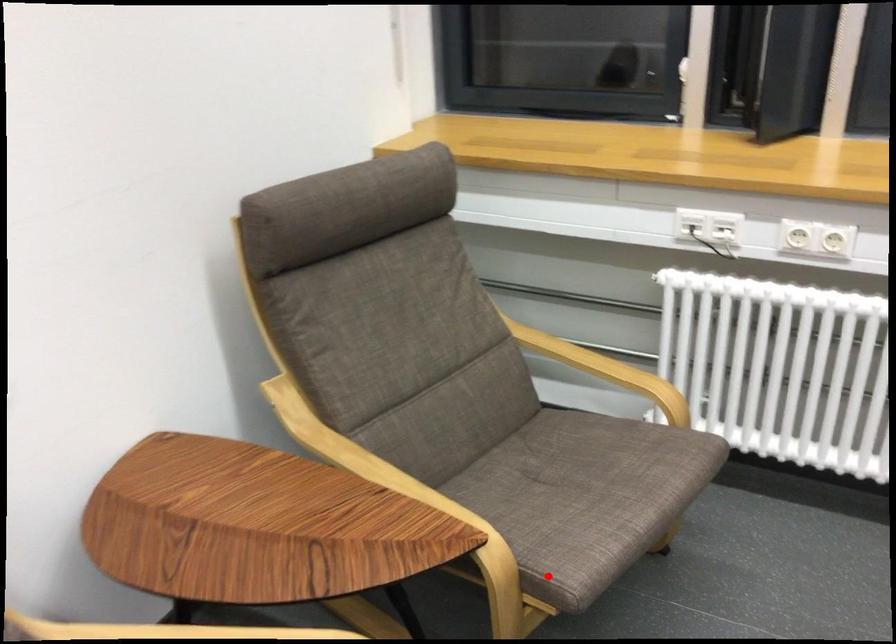
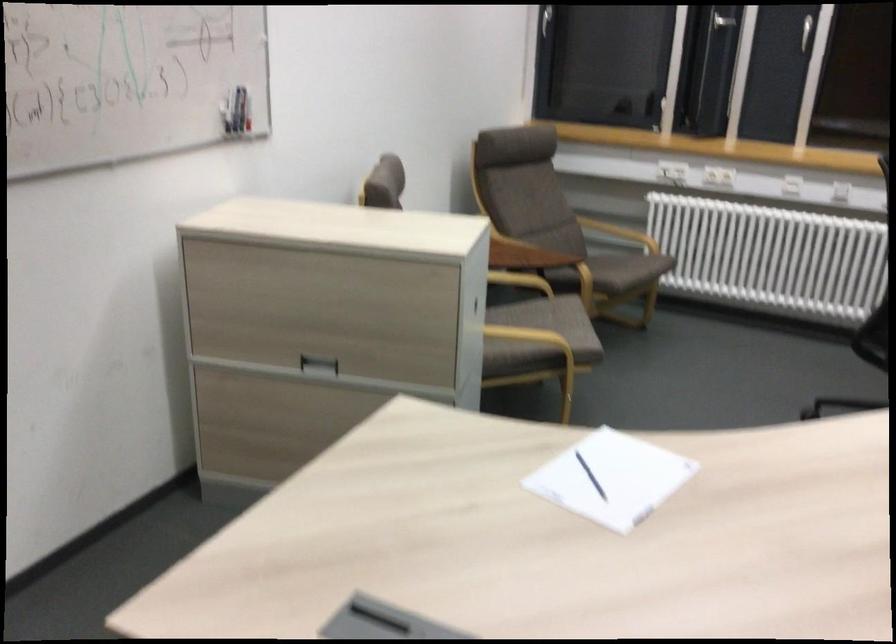
Question: I am providing you with two images of the same scene from different viewpoints. Given a red point in image1, look at the same physical point in image2. Is it:

Choices:
 (A) Closer to the viewpoint
 (B) Farther from the viewpoint

Answer: (B)